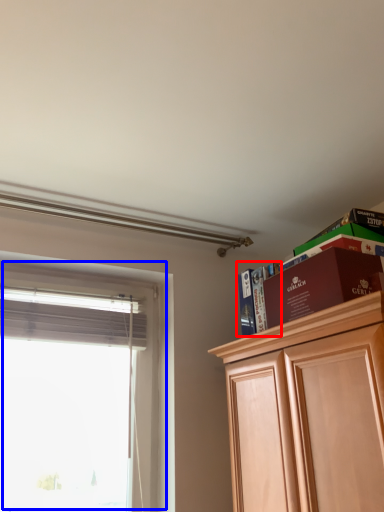
Question: Which point is closer to the camera, book (highlighted by a red box) or window (highlighted by a blue box)?

Choices:
 (A) book
 (B) window

Answer: (B)